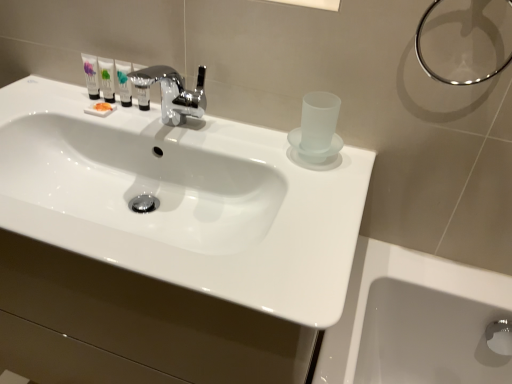
Where is `free spot to the right of translucent plastic tube at upper center, the 3th mouthwash viewed from the left`? The width and height of the screenshot is (512, 384). free spot to the right of translucent plastic tube at upper center, the 3th mouthwash viewed from the left is located at coordinates (188, 127).